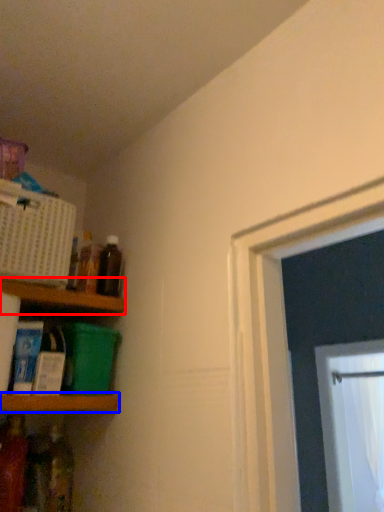
Question: Which object is further to the camera taking this photo, shelf (highlighted by a red box) or shelf (highlighted by a blue box)?

Choices:
 (A) shelf
 (B) shelf

Answer: (A)